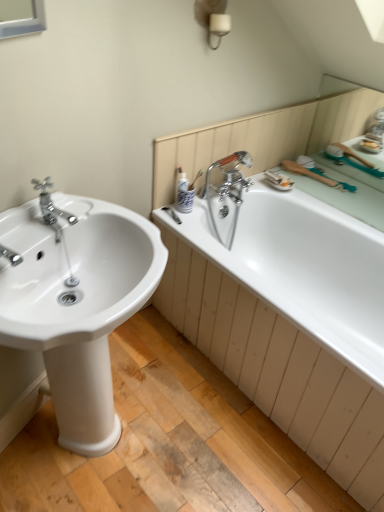
This screenshot has height=512, width=384. What are the coordinates of `unoccupied space behind polished chrome faucet at left` in the screenshot? It's located at (73, 207).